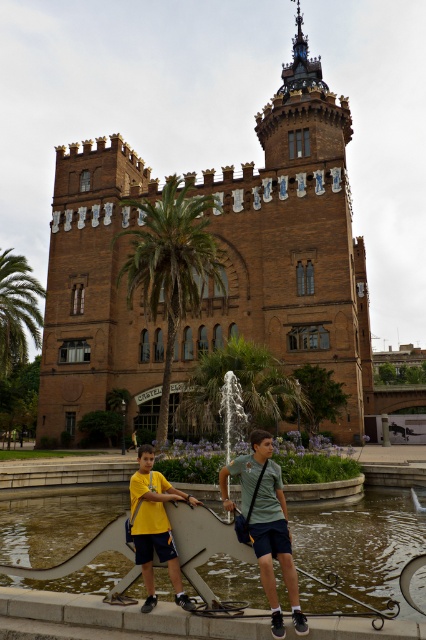
Question: Does light gray cotton shirt at center have a smaller size compared to yellow matte shirt at center?

Choices:
 (A) no
 (B) yes

Answer: (A)

Question: Which object appears farthest from the camera in this image?

Choices:
 (A) brown brick building at center
 (B) green leafy palm tree at center
 (C) gray concrete ledge at lower center

Answer: (B)

Question: Which point is closer to the camera taking this photo?

Choices:
 (A) (152, 196)
 (B) (123, 609)

Answer: (B)

Question: Is brown brick building at center to the left of light gray cotton shirt at center from the viewer's perspective?

Choices:
 (A) no
 (B) yes

Answer: (B)

Question: Can you confirm if green leafy palm tree at center is smaller than yellow fabric shirt at center?

Choices:
 (A) no
 (B) yes

Answer: (A)

Question: Which of these objects is positioned closest to the yellow fabric shirt at center?

Choices:
 (A) gray concrete ledge at lower center
 (B) brown brick building at center

Answer: (A)